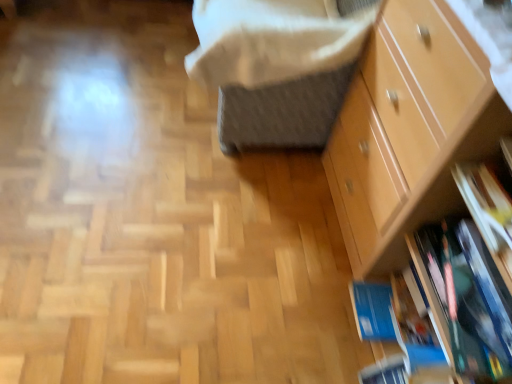
Question: Does light brown wooden chest of drawers at right lie in front of blue matte book at lower right?

Choices:
 (A) yes
 (B) no

Answer: (A)

Question: Is light brown wooden chest of drawers at right oriented away from blue matte book at lower right?

Choices:
 (A) yes
 (B) no

Answer: (A)

Question: Is light brown wooden chest of drawers at right further to camera compared to blue matte book at lower right?

Choices:
 (A) no
 (B) yes

Answer: (A)

Question: Does light brown wooden chest of drawers at right appear on the left side of blue matte book at lower right?

Choices:
 (A) yes
 (B) no

Answer: (B)

Question: Can you confirm if light brown wooden chest of drawers at right is thinner than blue matte book at lower right?

Choices:
 (A) yes
 (B) no

Answer: (B)

Question: In terms of height, does light brown wooden chest of drawers at right look taller or shorter compared to blue matte book at lower right?

Choices:
 (A) short
 (B) tall

Answer: (B)

Question: Choose the correct answer: Is light brown wooden chest of drawers at right inside blue matte book at lower right or outside it?

Choices:
 (A) outside
 (B) inside

Answer: (A)

Question: From a real-world perspective, is light brown wooden chest of drawers at right positioned above or below blue matte book at lower right?

Choices:
 (A) below
 (B) above

Answer: (B)

Question: Relative to blue matte book at lower right, is light brown wooden chest of drawers at right in front or behind?

Choices:
 (A) front
 (B) behind

Answer: (A)

Question: In the image, is white soft blanket at upper center positioned in front of or behind blue matte book at lower right?

Choices:
 (A) behind
 (B) front

Answer: (A)

Question: From their relative heights in the image, would you say white soft blanket at upper center is taller or shorter than blue matte book at lower right?

Choices:
 (A) tall
 (B) short

Answer: (A)

Question: Does point (357, 26) appear closer or farther from the camera than point (446, 279)?

Choices:
 (A) farther
 (B) closer

Answer: (A)

Question: From a real-world perspective, is white soft blanket at upper center above or below blue matte book at lower right?

Choices:
 (A) below
 (B) above

Answer: (B)

Question: In terms of size, does white soft blanket at upper center appear bigger or smaller than light brown wooden chest of drawers at right?

Choices:
 (A) big
 (B) small

Answer: (B)

Question: Would you say white soft blanket at upper center is to the left or to the right of light brown wooden chest of drawers at right in the picture?

Choices:
 (A) right
 (B) left

Answer: (B)